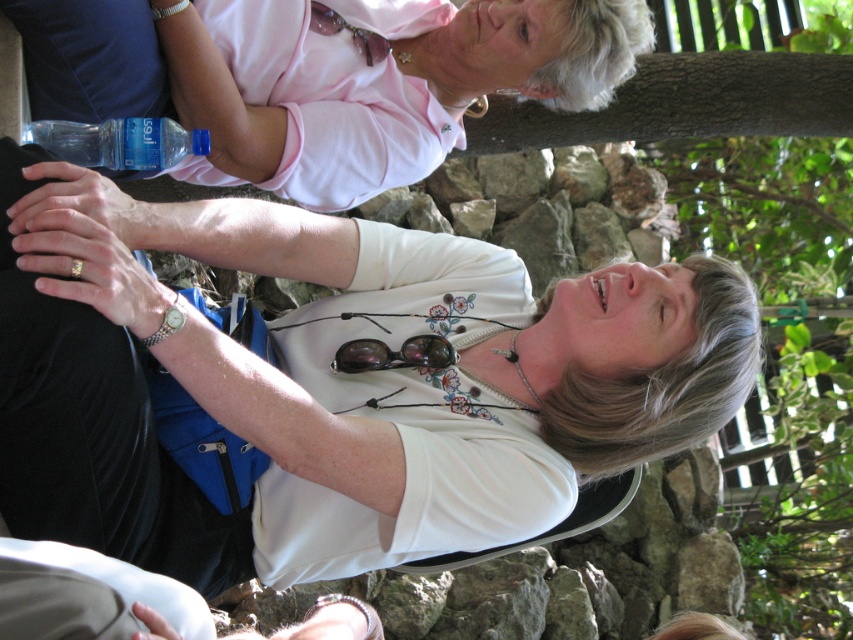
You are trying to locate the pink fabric shirt at upper center and the matte black goggles at center in the image. Which object is positioned to the left of the other?

The pink fabric shirt at upper center is to the left of matte black goggles at center.

You are a photographer trying to capture a candid shot of the two people in the scene. You want to ensure that both the pink fabric shirt at upper center and the matte black goggles at center are in focus. Given that your camera has a depth of field that can cover 3 feet, will you need to adjust your settings to include both subjects?

The distance between the pink fabric shirt at upper center and the matte black goggles at center is 3.62 feet. Since the depth of field can only cover 3 feet, you will need to adjust your settings to ensure both are in focus.

You are trying to determine the relative positions of the pink fabric shirt at upper center and the matte black goggles at center in the image. Which object is taller?

The pink fabric shirt at upper center is taller than the matte black goggles at center according to the description.